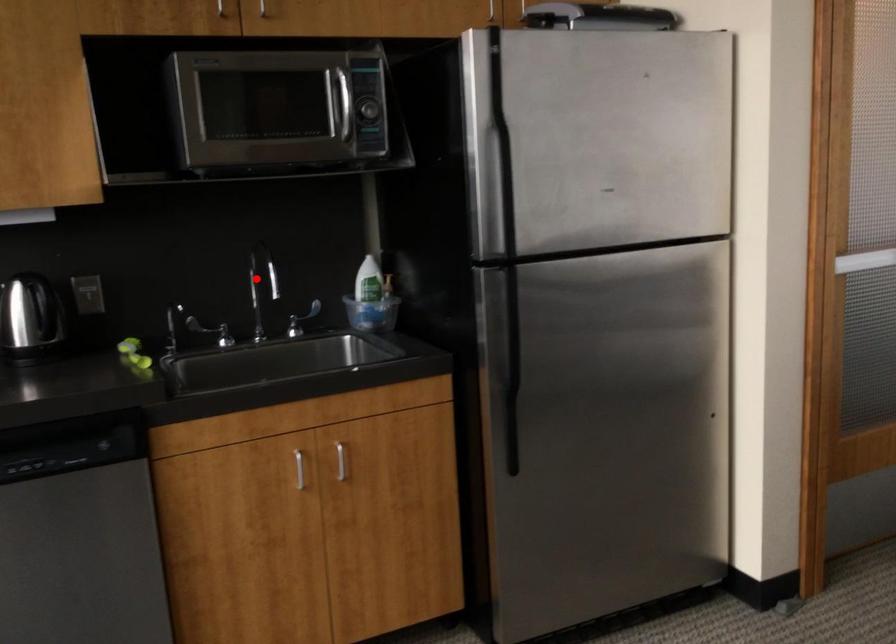
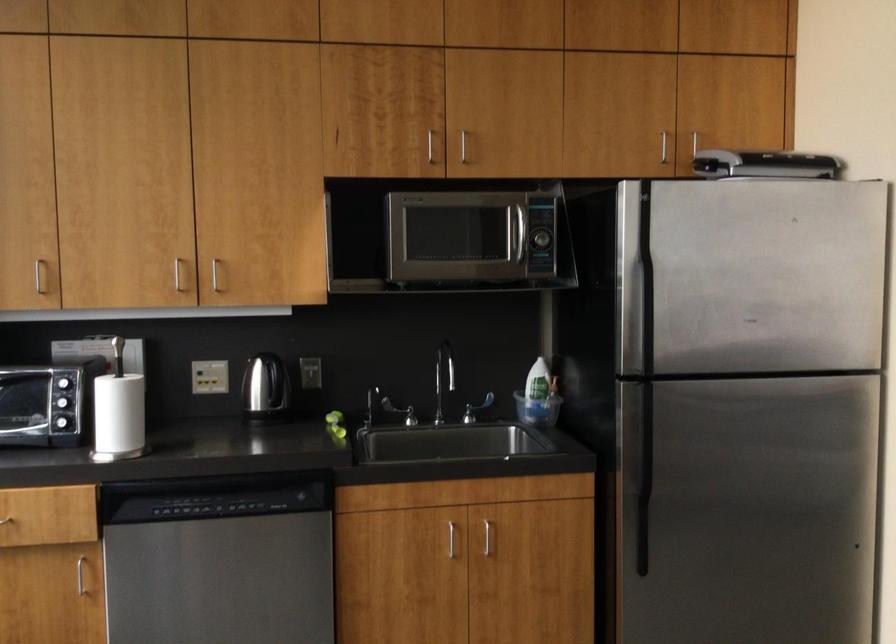
Question: I am providing you with two images of the same scene from different viewpoints. A red point is shown in image1. For the corresponding object point in image2, is it positioned nearer or farther from the camera?

Choices:
 (A) Nearer
 (B) Farther

Answer: (B)